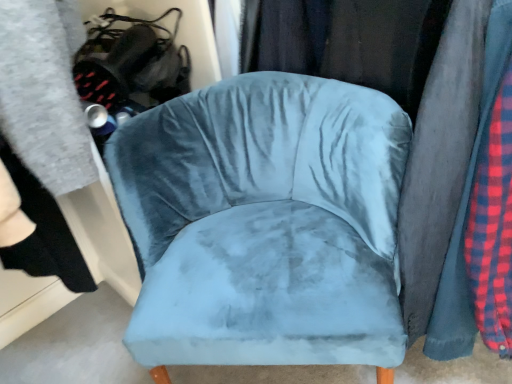
This screenshot has width=512, height=384. What do you see at coordinates (265, 223) in the screenshot?
I see `velvet blue chair at center` at bounding box center [265, 223].

Where is `velvet blue chair at center`? velvet blue chair at center is located at coordinates pyautogui.click(x=265, y=223).

Identify the location of velvet blue chair at center. This screenshot has height=384, width=512. (265, 223).